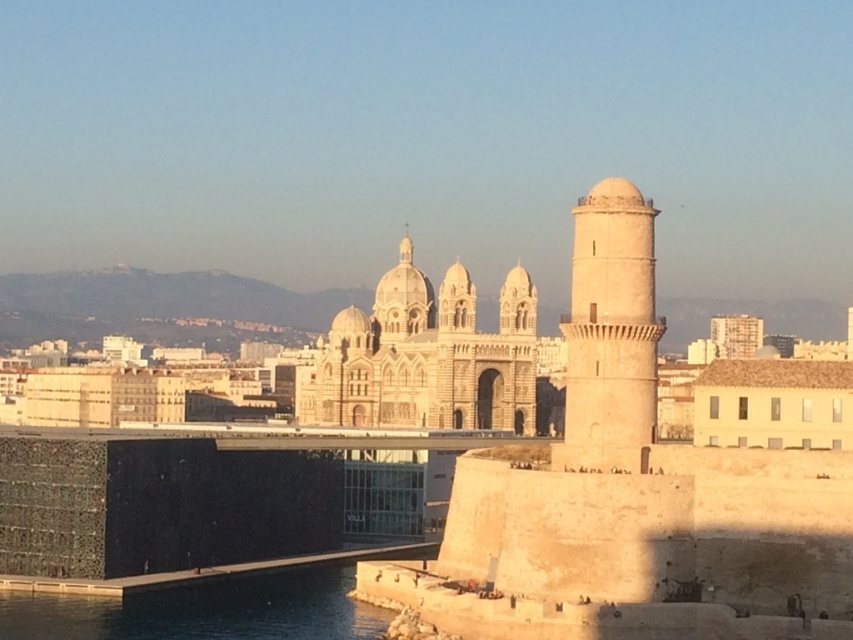
Question: Can you confirm if light beige stone tower at right is smaller than blue glass water at lower left?

Choices:
 (A) no
 (B) yes

Answer: (A)

Question: Is beige stone cathedral at center bigger than blue glass water at lower left?

Choices:
 (A) yes
 (B) no

Answer: (A)

Question: Which object appears closest to the camera in this image?

Choices:
 (A) light beige stone tower at right
 (B) beige stone cathedral at center
 (C) blue glass water at lower left

Answer: (C)

Question: From the image, what is the correct spatial relationship of light beige stone tower at right in relation to blue glass water at lower left?

Choices:
 (A) left
 (B) right

Answer: (B)

Question: Among these points, which one is nearest to the camera?

Choices:
 (A) (637, 428)
 (B) (486, 339)

Answer: (A)

Question: Estimate the real-world distances between objects in this image. Which object is closer to the blue glass water at lower left?

Choices:
 (A) beige stone cathedral at center
 (B) light beige stone tower at right

Answer: (B)